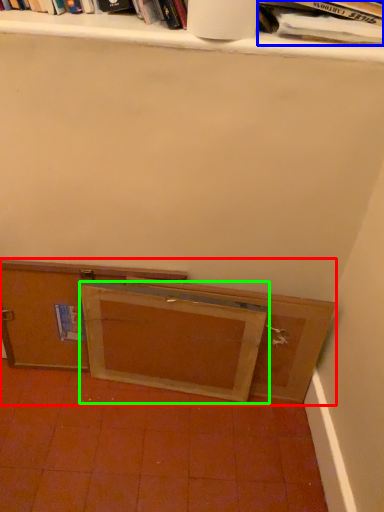
Question: Which object is positioned farthest from cabinetry (highlighted by a red box)? Select from book (highlighted by a blue box) and wide (highlighted by a green box).

Choices:
 (A) book
 (B) wide

Answer: (A)